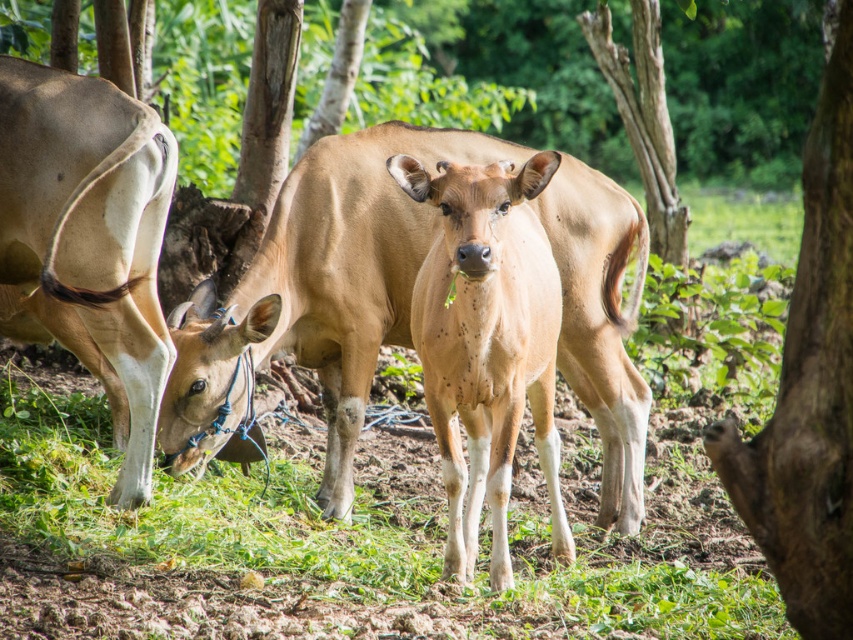
Is green grass at center positioned at the back of light brown smooth calf at center?

Yes.

Does green grass at center have a smaller size compared to light brown smooth calf at center?

No, green grass at center is not smaller than light brown smooth calf at center.

Is point (613, 616) closer to camera compared to point (465, 564)?

Yes, point (613, 616) is closer to viewer.

Identify the location of green grass at center. The height and width of the screenshot is (640, 853). (355, 528).

Between green grass at center and brown rough bark tree at right, which one has less height?

green grass at center

Where is `green grass at center`? The width and height of the screenshot is (853, 640). green grass at center is located at coordinates (355, 528).

In the scene shown: Between green grass at center and light brown leather cow at left, which one appears on the right side from the viewer's perspective?

From the viewer's perspective, green grass at center appears more on the right side.

Does green grass at center have a smaller size compared to light brown leather cow at left?

No, green grass at center is not smaller than light brown leather cow at left.

Where is `green grass at center`? green grass at center is located at coordinates (355, 528).

Where is `green grass at center`? This screenshot has width=853, height=640. green grass at center is located at coordinates (355, 528).